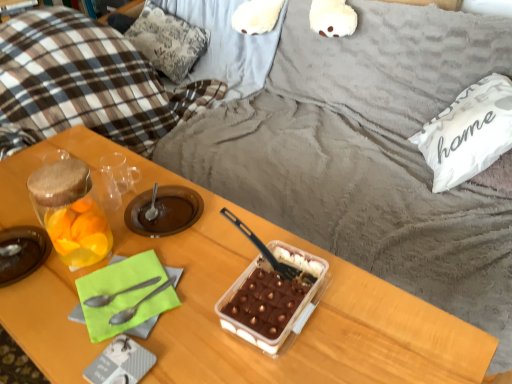
Locate an element on the screen. This screenshot has width=512, height=384. vacant space behind translucent glass jar at left is located at coordinates (36, 208).